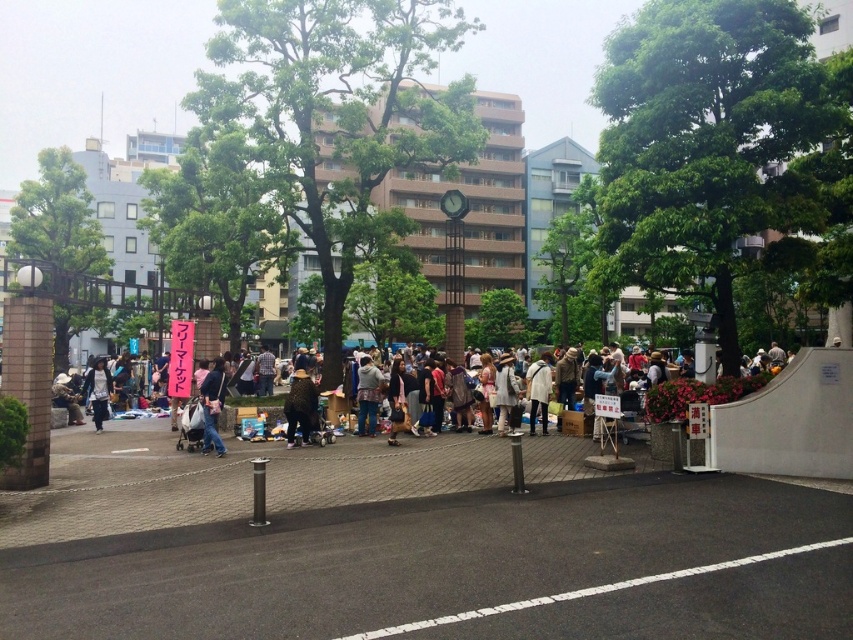
You are standing at the camera position and want to walk to both points in the image. Which point should you reach first, point (469, 616) or point (706, 394)?

You will reach point (469, 616) first because it is closer to the camera than point (706, 394).

You are a vendor at the flea market and need to place the leopard print coat at center and the white fuzzy jacket at center on a display table. Which item should you place first if you want to arrange them from smallest to largest?

The leopard print coat at center is smaller than the white fuzzy jacket at center, so you should place the leopard print coat at center first to arrange them from smallest to largest.